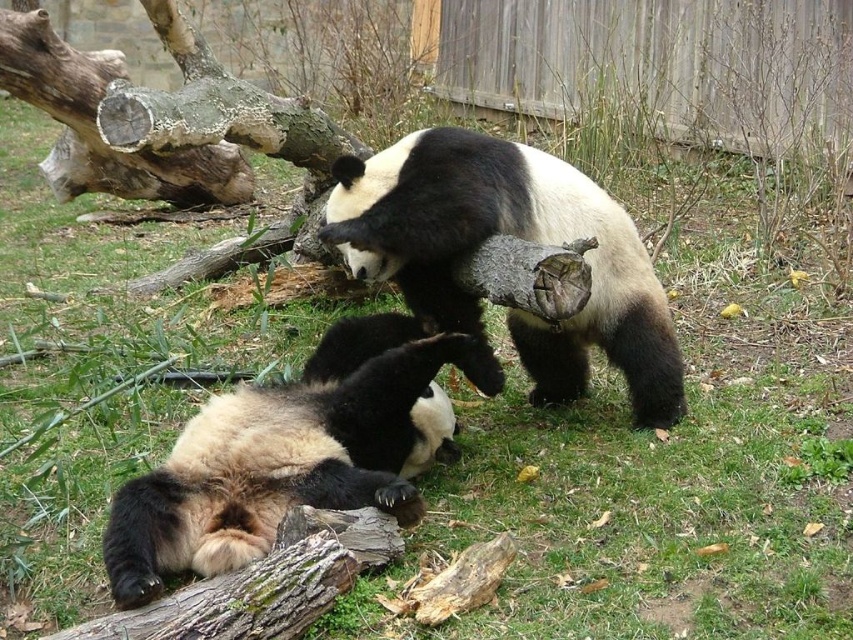
Which of these two, soft fur panda at lower left or brown rough bark tree trunk at upper left, stands taller?

With more height is brown rough bark tree trunk at upper left.

Can you confirm if soft fur panda at lower left is wider than brown rough bark tree trunk at upper left?

In fact, soft fur panda at lower left might be narrower than brown rough bark tree trunk at upper left.

Is point (283, 477) closer to camera compared to point (26, 96)?

Yes.

You are a GUI agent. You are given a task and a screenshot of the screen. Output one action in this format:
    pyautogui.click(x=<x>, y=<y>)
    Task: Click on the soft fur panda at lower left
    Image resolution: width=853 pixels, height=640 pixels.
    Given the screenshot: What is the action you would take?
    pyautogui.click(x=293, y=452)

Describe the element at coordinates (293, 452) in the screenshot. I see `soft fur panda at lower left` at that location.

Which is above, soft fur panda at lower left or black and white fur at center?

black and white fur at center

You are a GUI agent. You are given a task and a screenshot of the screen. Output one action in this format:
    pyautogui.click(x=<x>, y=<y>)
    Task: Click on the soft fur panda at lower left
    This screenshot has width=853, height=640.
    Given the screenshot: What is the action you would take?
    pyautogui.click(x=293, y=452)

Locate an element on the screen. This screenshot has width=853, height=640. soft fur panda at lower left is located at coordinates (293, 452).

Between black and white fur at center and brown rough bark tree trunk at upper left, which one appears on the right side from the viewer's perspective?

Positioned to the right is black and white fur at center.

Can you confirm if black and white fur at center is shorter than brown rough bark tree trunk at upper left?

In fact, black and white fur at center may be taller than brown rough bark tree trunk at upper left.

Is point (374, 221) behind point (83, 56)?

No, it is not.

Locate an element on the screen. black and white fur at center is located at coordinates [x=518, y=236].